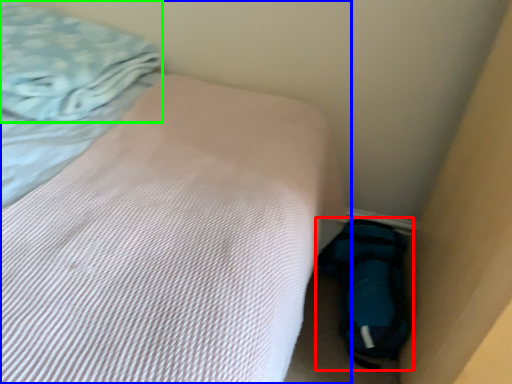
Question: Based on their relative distances, which object is nearer to sleeping bag (highlighted by a red box)? Choose from bed (highlighted by a blue box) and blanket (highlighted by a green box).

Choices:
 (A) bed
 (B) blanket

Answer: (A)